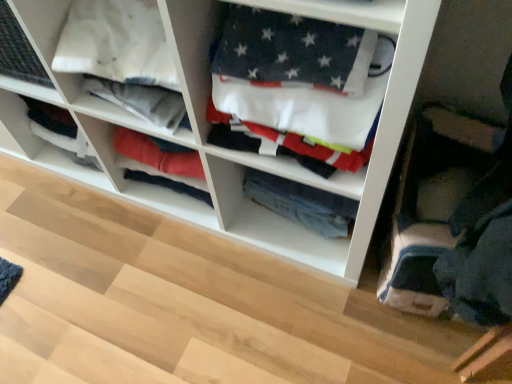
Find the location of a particular element. This screenshot has width=512, height=384. white cotton flag at center, which is the 2th clothing in back-to-front order is located at coordinates (301, 83).

Measure the distance between denim jeans at center, the second clothing in the front-to-back sequence, and camera.

3.32 feet.

At what (x,y) coordinates should I click in order to perform the action: click on white fabric at center. Please return your answer as a coordinate pair (x, y). Image resolution: width=512 pixels, height=384 pixels. Looking at the image, I should click on (208, 126).

At what (x,y) coordinates should I click in order to perform the action: click on white cotton flag at center, the 1th clothing in the front-to-back sequence. Please return your answer as a coordinate pair (x, y). Looking at the image, I should click on (301, 83).

Would you say denim jeans at center, the second clothing in the front-to-back sequence, is outside white fabric at center?

No, denim jeans at center, the second clothing in the front-to-back sequence, is not outside of white fabric at center.

From the image's perspective, between denim jeans at center, the second clothing in the front-to-back sequence, and white fabric at center, who is located below?

denim jeans at center, the second clothing in the front-to-back sequence.

Is white fabric at center at the back of denim jeans at center, the second clothing in the front-to-back sequence?

Correct, denim jeans at center, the second clothing in the front-to-back sequence, is looking away from white fabric at center.

Between denim jeans at center, the second clothing in the front-to-back sequence, and white cotton flag at center, which is the 2th clothing in back-to-front order, which one is positioned in front?

white cotton flag at center, which is the 2th clothing in back-to-front order, is more forward.

Is denim jeans at center, the second clothing in the front-to-back sequence, touching white cotton flag at center, which is the 2th clothing in back-to-front order?

No.

Is point (340, 222) positioned in front of point (298, 144)?

No, it is not.

From the image's perspective, which one is positioned lower, white cotton flag at center, the 1th clothing in the front-to-back sequence, or denim jeans at center, the second clothing in the front-to-back sequence?

Answer: denim jeans at center, the second clothing in the front-to-back sequence.

Between white cotton flag at center, which is the 2th clothing in back-to-front order, and denim jeans at center, arranged as the 1th clothing when viewed from the back, which one has larger size?

white cotton flag at center, which is the 2th clothing in back-to-front order, is bigger.

From their relative heights in the image, would you say white cotton flag at center, which is the 2th clothing in back-to-front order, is taller or shorter than denim jeans at center, arranged as the 1th clothing when viewed from the back?

Considering their sizes, white cotton flag at center, which is the 2th clothing in back-to-front order, has more height than denim jeans at center, arranged as the 1th clothing when viewed from the back.

Is white cotton flag at center, the 1th clothing in the front-to-back sequence, turned away from denim jeans at center, arranged as the 1th clothing when viewed from the back?

No, white cotton flag at center, the 1th clothing in the front-to-back sequence, is not facing away from denim jeans at center, arranged as the 1th clothing when viewed from the back.

Which object is wider, white fabric at center or white cotton flag at center, the 1th clothing in the front-to-back sequence?

Wider between the two is white fabric at center.

Considering the sizes of objects white fabric at center and white cotton flag at center, which is the 2th clothing in back-to-front order, in the image provided, who is shorter, white fabric at center or white cotton flag at center, which is the 2th clothing in back-to-front order,?

Standing shorter between the two is white cotton flag at center, which is the 2th clothing in back-to-front order.

Are white fabric at center and white cotton flag at center, which is the 2th clothing in back-to-front order, beside each other?

There is a gap between white fabric at center and white cotton flag at center, which is the 2th clothing in back-to-front order.

From the picture: Measure the distance from white fabric at center to white cotton flag at center, which is the 2th clothing in back-to-front order.

They are 6.86 inches apart.

What are the coordinates of `the 2nd clothing behind when counting from the white fabric at center` in the screenshot? It's located at (302, 203).

Which object is more forward, white fabric at center or denim jeans at center, arranged as the 1th clothing when viewed from the back?

Positioned in front is white fabric at center.

Does white fabric at center turn towards denim jeans at center, the second clothing in the front-to-back sequence?

Yes.

In terms of height, does white cotton flag at center, the 1th clothing in the front-to-back sequence, look taller or shorter compared to white fabric at center?

In the image, white cotton flag at center, the 1th clothing in the front-to-back sequence, appears to be shorter than white fabric at center.

Measure the distance from white cotton flag at center, which is the 2th clothing in back-to-front order, to white fabric at center.

white cotton flag at center, which is the 2th clothing in back-to-front order, is 6.86 inches away from white fabric at center.

From the image's perspective, would you say white cotton flag at center, which is the 2th clothing in back-to-front order, is shown under white fabric at center?

Yes, from the image's perspective, white cotton flag at center, which is the 2th clothing in back-to-front order, is beneath white fabric at center.

You are a GUI agent. You are given a task and a screenshot of the screen. Output one action in this format:
    pyautogui.click(x=<x>, y=<y>)
    Task: Click on the 1st clothing counting from the right side of the white fabric at center
    This screenshot has width=512, height=384.
    Given the screenshot: What is the action you would take?
    pyautogui.click(x=301, y=83)

Starting from the white fabric at center, which clothing is the 2nd one behind? Please provide its 2D coordinates.

[(302, 203)]

Where is `clothing that appears in front of the denim jeans at center, the second clothing in the front-to-back sequence`? Image resolution: width=512 pixels, height=384 pixels. clothing that appears in front of the denim jeans at center, the second clothing in the front-to-back sequence is located at coordinates (301, 83).

In the scene shown: Based on their spatial positions, is denim jeans at center, arranged as the 1th clothing when viewed from the back, or white cotton flag at center, the 1th clothing in the front-to-back sequence, closer to white fabric at center?

The object closer to white fabric at center is white cotton flag at center, the 1th clothing in the front-to-back sequence.

Based on their spatial positions, is white fabric at center or white cotton flag at center, the 1th clothing in the front-to-back sequence, closer to denim jeans at center, the second clothing in the front-to-back sequence?

Based on the image, white fabric at center appears to be nearer to denim jeans at center, the second clothing in the front-to-back sequence.

When comparing their distances from denim jeans at center, arranged as the 1th clothing when viewed from the back, does white cotton flag at center, the 1th clothing in the front-to-back sequence, or white fabric at center seem closer?

Based on the image, white fabric at center appears to be nearer to denim jeans at center, arranged as the 1th clothing when viewed from the back.

In the scene shown: From the image, which object appears to be nearer to white cotton flag at center, the 1th clothing in the front-to-back sequence, denim jeans at center, arranged as the 1th clothing when viewed from the back, or white fabric at center?

Based on the image, white fabric at center appears to be nearer to white cotton flag at center, the 1th clothing in the front-to-back sequence.

Which object lies further to the anchor point white fabric at center, white cotton flag at center, the 1th clothing in the front-to-back sequence, or denim jeans at center, arranged as the 1th clothing when viewed from the back?

Based on the image, denim jeans at center, arranged as the 1th clothing when viewed from the back, appears to be further to white fabric at center.

From the image, which object appears to be nearer to white cotton flag at center, which is the 2th clothing in back-to-front order, white fabric at center or denim jeans at center, the second clothing in the front-to-back sequence?

white fabric at center is positioned closer to the anchor white cotton flag at center, which is the 2th clothing in back-to-front order.

This screenshot has width=512, height=384. I want to click on clothing located between white fabric at center and denim jeans at center, arranged as the 1th clothing when viewed from the back, in the left-right direction, so click(x=301, y=83).